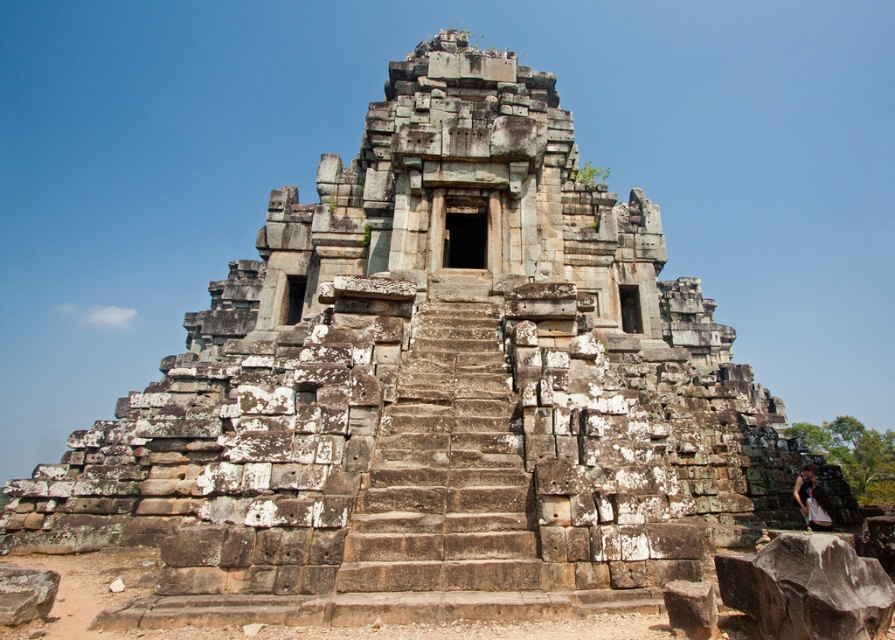
Is brown stone stairs at center behind white cotton dress at lower right?

No.

Is point (406, 448) positioned after point (806, 477)?

No, (406, 448) is closer to viewer.

The height and width of the screenshot is (640, 895). What are the coordinates of `brown stone stairs at center` in the screenshot? It's located at (448, 468).